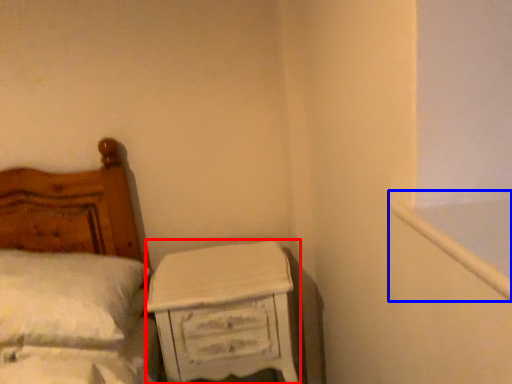
Question: Which object appears closest to the camera in this image, nightstand (highlighted by a red box) or window frame (highlighted by a blue box)?

Choices:
 (A) nightstand
 (B) window frame

Answer: (B)